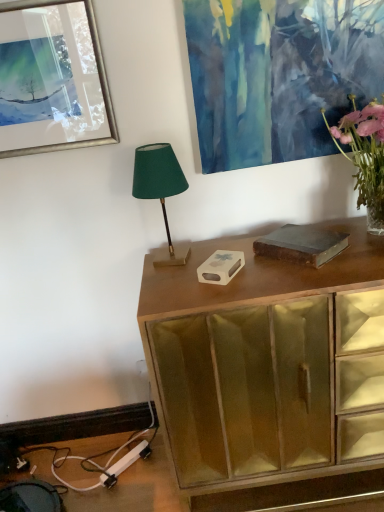
Identify the location of vacant space in pink glass vase at upper right (from a real-world perspective). (362, 233).